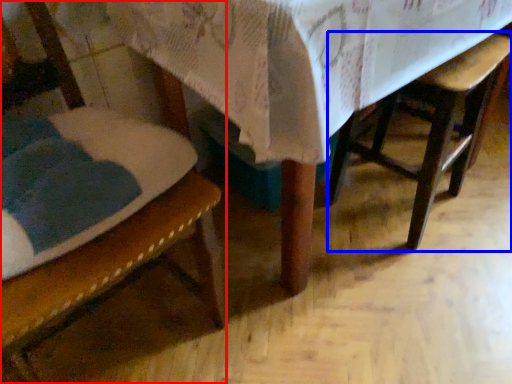
Question: Which point is further to the camera, chair (highlighted by a red box) or armchair (highlighted by a blue box)?

Choices:
 (A) chair
 (B) armchair

Answer: (B)